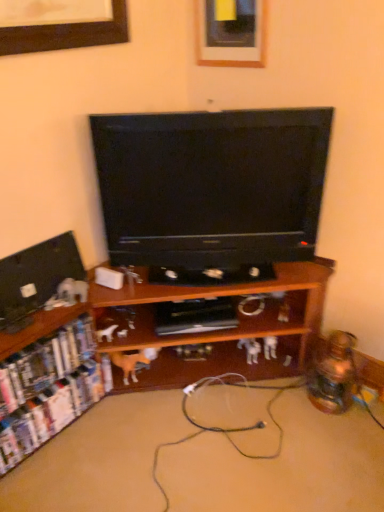
Locate an element on the screen. The height and width of the screenshot is (512, 384). vacant area that is situated to the right of white cardboard shelf at lower left, positioned as the second shelf in right-to-left order is located at coordinates (116, 439).